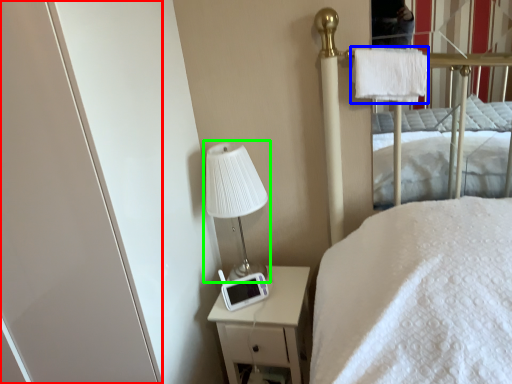
Question: Considering the real-world distances, which object is closest to screen door (highlighted by a red box)? cloth (highlighted by a blue box) or table lamp (highlighted by a green box).

Choices:
 (A) cloth
 (B) table lamp

Answer: (B)